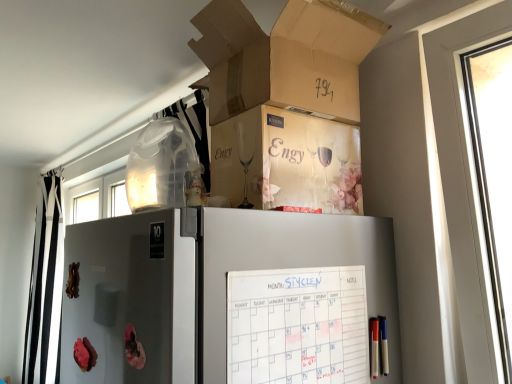
Locate an element on the screen. Image resolution: width=512 pixels, height=384 pixels. metallic silver screen door at lower left is located at coordinates (133, 298).

The height and width of the screenshot is (384, 512). Describe the element at coordinates (42, 279) in the screenshot. I see `black/white striped curtain at left` at that location.

Image resolution: width=512 pixels, height=384 pixels. Describe the element at coordinates (286, 57) in the screenshot. I see `cardboard box at upper center` at that location.

Locate an element on the screen. The height and width of the screenshot is (384, 512). metallic silver screen door at lower left is located at coordinates [133, 298].

Is white paper calendar at upper center looking in the opposite direction of beige cardboard box at upper center?

white paper calendar at upper center is not turned away from beige cardboard box at upper center.

Is white paper calendar at upper center shorter than beige cardboard box at upper center?

No.

In terms of width, does white paper calendar at upper center look wider or thinner when compared to beige cardboard box at upper center?

white paper calendar at upper center is thinner than beige cardboard box at upper center.

Does point (346, 275) appear closer or farther from the camera than point (244, 175)?

Point (346, 275).

Between black/white striped curtain at left and metallic silver screen door at lower left, which one has more height?

Standing taller between the two is black/white striped curtain at left.

Can you see black/white striped curtain at left touching metallic silver screen door at lower left?

black/white striped curtain at left and metallic silver screen door at lower left are clearly separated.

Between black/white striped curtain at left and metallic silver screen door at lower left, which one is positioned in front?

metallic silver screen door at lower left.

Can you confirm if black/white striped curtain at left is thinner than metallic silver screen door at lower left?

Incorrect, the width of black/white striped curtain at left is not less than that of metallic silver screen door at lower left.

Is metallic silver screen door at lower left positioned far away from beige cardboard box at upper center?

No, metallic silver screen door at lower left is not far from beige cardboard box at upper center.

The image size is (512, 384). I want to click on screen door that is on the left side of beige cardboard box at upper center, so click(133, 298).

Would you say metallic silver screen door at lower left is inside or outside beige cardboard box at upper center?

metallic silver screen door at lower left is spatially situated outside beige cardboard box at upper center.

Looking at this image, can you confirm if metallic silver screen door at lower left is bigger than beige cardboard box at upper center?

Actually, metallic silver screen door at lower left might be smaller than beige cardboard box at upper center.

Consider the image. Is cardboard box at upper center positioned before beige cardboard box at upper center?

Yes, it is.

Based on the photo, from the image's perspective, relative to beige cardboard box at upper center, is cardboard box at upper center above or below?

From the image's perspective, cardboard box at upper center appears above beige cardboard box at upper center.

Consider the image. Is cardboard box at upper center completely or partially outside of beige cardboard box at upper center?

That's correct, cardboard box at upper center is outside of beige cardboard box at upper center.

Between cardboard box at upper center and beige cardboard box at upper center, which one has larger size?

With larger size is cardboard box at upper center.

Is metallic silver screen door at lower left looking in the opposite direction of black/white striped curtain at left?

That's not correct — metallic silver screen door at lower left is not looking away from black/white striped curtain at left.

Does metallic silver screen door at lower left touch black/white striped curtain at left?

metallic silver screen door at lower left and black/white striped curtain at left are not in contact.

Between metallic silver screen door at lower left and black/white striped curtain at left, which one appears on the right side from the viewer's perspective?

From the viewer's perspective, metallic silver screen door at lower left appears more on the right side.

Which of these two, metallic silver screen door at lower left or black/white striped curtain at left, is smaller?

Smaller between the two is metallic silver screen door at lower left.

Does white paper calendar at upper center have a greater height compared to black/white striped curtain at left?

No, white paper calendar at upper center is not taller than black/white striped curtain at left.

Does white paper calendar at upper center lie behind black/white striped curtain at left?

No, white paper calendar at upper center is closer to the viewer.

From a real-world perspective, is white paper calendar at upper center below black/white striped curtain at left?

Incorrect, from a real-world perspective, white paper calendar at upper center is higher than black/white striped curtain at left.

From the image's perspective, does metallic silver screen door at lower left appear lower than cardboard box at upper center?

Yes, from the image's perspective, metallic silver screen door at lower left is below cardboard box at upper center.

At what (x,y) coordinates should I click in order to perform the action: click on box above the metallic silver screen door at lower left (from the image's perspective). Please return your answer as a coordinate pair (x, y). Looking at the image, I should click on (286, 57).

Could cardboard box at upper center be considered to be inside metallic silver screen door at lower left?

Definitely not — cardboard box at upper center is not inside metallic silver screen door at lower left.

Is cardboard box at upper center at the back of metallic silver screen door at lower left?

No, cardboard box at upper center is not at the back of metallic silver screen door at lower left.

Identify the location of checklist below the beige cardboard box at upper center (from the image's perspective). (297, 326).

The width and height of the screenshot is (512, 384). There is a black/white striped curtain at left. Identify the location of screen door above it (from a real-world perspective). (133, 298).

Which object lies further to the anchor point black/white striped curtain at left, beige cardboard box at upper center or white paper calendar at upper center?

Among the two, white paper calendar at upper center is located further to black/white striped curtain at left.

Based on the photo, from the image, which object appears to be farther from black/white striped curtain at left, white paper calendar at upper center or beige cardboard box at upper center?

white paper calendar at upper center lies further to black/white striped curtain at left than the other object.

Which object lies further to the anchor point black/white striped curtain at left, beige cardboard box at upper center or metallic silver screen door at lower left?

Among the two, beige cardboard box at upper center is located further to black/white striped curtain at left.

When comparing their distances from cardboard box at upper center, does black/white striped curtain at left or beige cardboard box at upper center seem closer?

beige cardboard box at upper center lies closer to cardboard box at upper center than the other object.

Considering their positions, is black/white striped curtain at left positioned further to white paper calendar at upper center than cardboard box at upper center?

Among the two, black/white striped curtain at left is located further to white paper calendar at upper center.

Looking at the image, which one is located closer to cardboard box at upper center, beige cardboard box at upper center or white paper calendar at upper center?

beige cardboard box at upper center lies closer to cardboard box at upper center than the other object.

When comparing their distances from cardboard box at upper center, does metallic silver screen door at lower left or white paper calendar at upper center seem further?

The object further to cardboard box at upper center is white paper calendar at upper center.

When comparing their distances from beige cardboard box at upper center, does white paper calendar at upper center or metallic silver screen door at lower left seem closer?

The object closer to beige cardboard box at upper center is white paper calendar at upper center.

Where is `storage box between cardboard box at upper center and metallic silver screen door at lower left from top to bottom`? This screenshot has height=384, width=512. storage box between cardboard box at upper center and metallic silver screen door at lower left from top to bottom is located at coordinates (287, 161).

Identify the location of checklist located between metallic silver screen door at lower left and black/white striped curtain at left in the depth direction. (297, 326).

I want to click on storage box between cardboard box at upper center and black/white striped curtain at left in the front-back direction, so click(x=287, y=161).

Where is `checklist between metallic silver screen door at lower left and beige cardboard box at upper center`? This screenshot has width=512, height=384. checklist between metallic silver screen door at lower left and beige cardboard box at upper center is located at coordinates (297, 326).